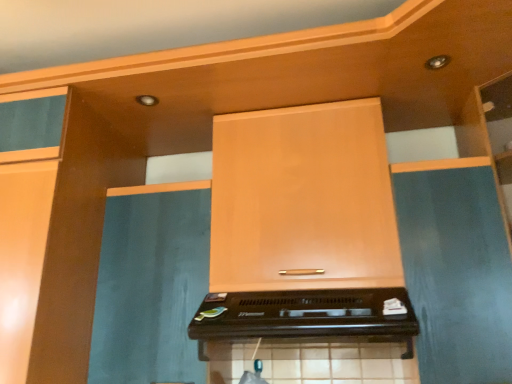
Question: Considering the positions of matte wood cabinet at center and black plastic toaster at center in the image, is matte wood cabinet at center taller or shorter than black plastic toaster at center?

Choices:
 (A) short
 (B) tall

Answer: (B)

Question: In terms of size, does matte wood cabinet at center appear bigger or smaller than black plastic toaster at center?

Choices:
 (A) big
 (B) small

Answer: (A)

Question: Is point (264, 236) closer or farther from the camera than point (358, 322)?

Choices:
 (A) closer
 (B) farther

Answer: (B)

Question: Based on their positions, is black plastic toaster at center located to the left or right of matte wood cabinet at center?

Choices:
 (A) right
 (B) left

Answer: (B)

Question: Is black plastic toaster at center bigger or smaller than matte wood cabinet at center?

Choices:
 (A) big
 (B) small

Answer: (B)

Question: Is point (339, 324) positioned closer to the camera than point (236, 210)?

Choices:
 (A) farther
 (B) closer

Answer: (B)

Question: From the image's perspective, is black plastic toaster at center above or below matte wood cabinet at center?

Choices:
 (A) below
 (B) above

Answer: (A)